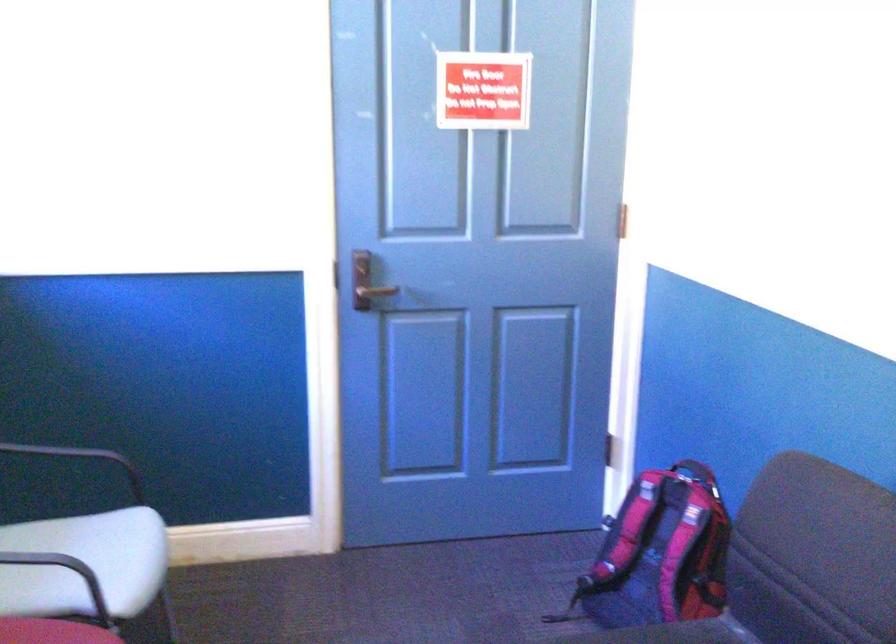
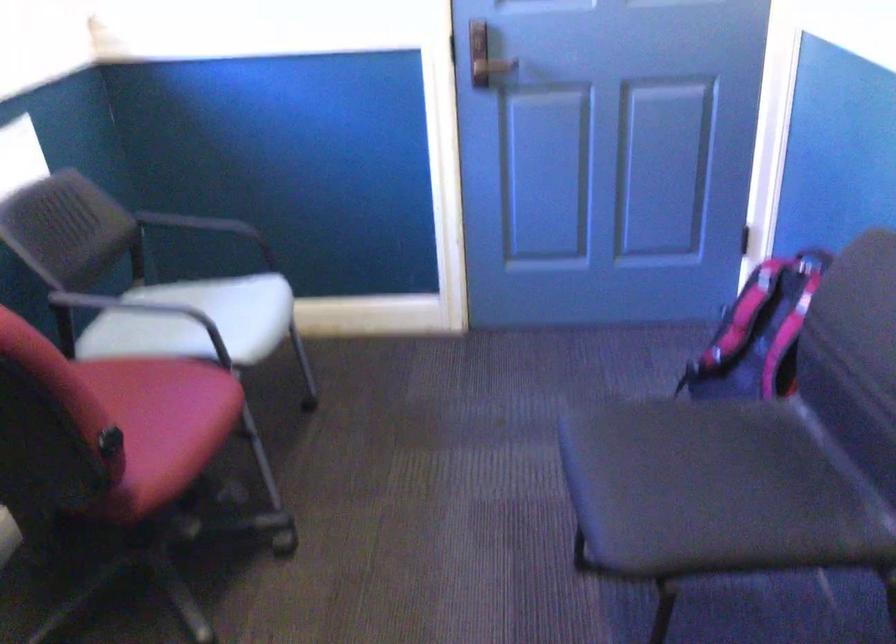
In the second image, find the point that corresponds to the point at 649,543 in the first image.

(759, 333)